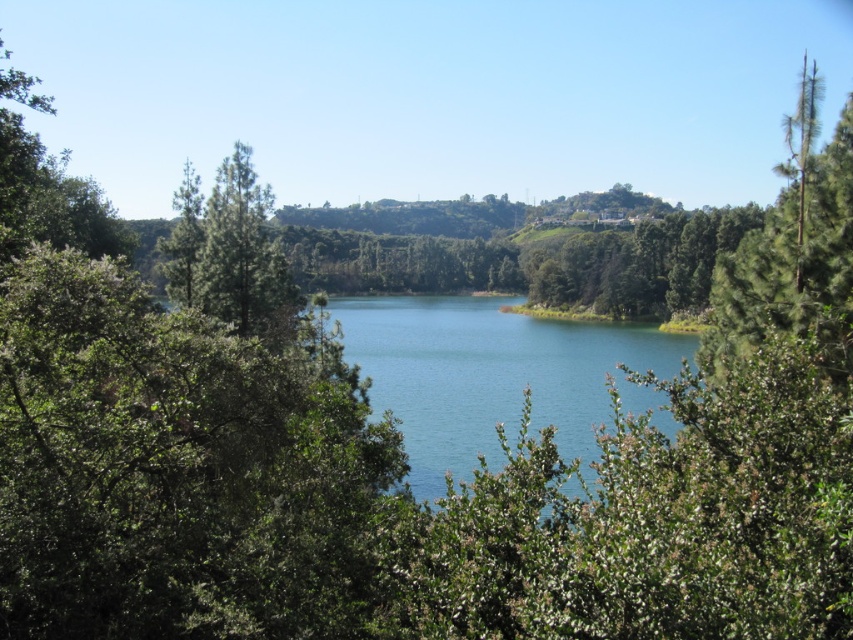
Question: Is clear blue water at center positioned before green rough bark tree at right?

Choices:
 (A) no
 (B) yes

Answer: (A)

Question: Which point is closer to the camera?

Choices:
 (A) (724, 282)
 (B) (485, 307)

Answer: (A)

Question: Can you confirm if clear blue water at center is smaller than green rough bark tree at right?

Choices:
 (A) no
 (B) yes

Answer: (B)

Question: Does clear blue water at center have a greater width compared to green rough bark tree at right?

Choices:
 (A) no
 (B) yes

Answer: (A)